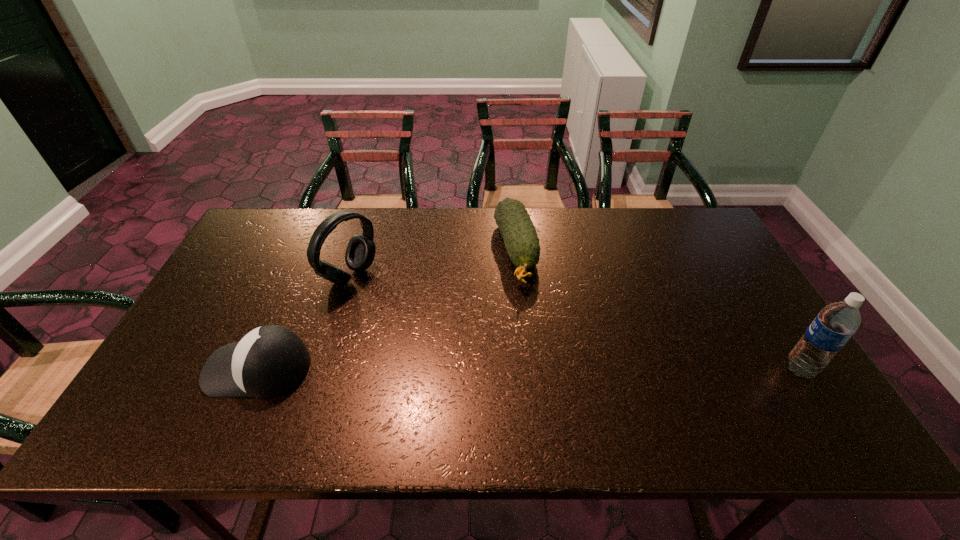
Locate an element on the screen. This screenshot has height=540, width=960. vacant space located on the earcups of the headset is located at coordinates (435, 326).

I want to click on free space located on the earcups of the headset, so click(x=424, y=319).

This screenshot has height=540, width=960. I want to click on object that is at the far edge, so click(x=520, y=237).

Identify the location of cap present at the near edge. (270, 360).

You are a GUI agent. You are given a task and a screenshot of the screen. Output one action in this format:
    pyautogui.click(x=<x>, y=<y>)
    Task: Click on the water bottle that is at the near edge
    
    Given the screenshot: What is the action you would take?
    pyautogui.click(x=836, y=323)

Locate an element on the screen. This screenshot has width=960, height=540. object located in the left edge section of the desktop is located at coordinates (270, 360).

In order to click on object situated at the right edge in this screenshot , I will do `click(836, 323)`.

Where is `object that is positioned at the near left corner`? object that is positioned at the near left corner is located at coordinates (270, 360).

You are a GUI agent. You are given a task and a screenshot of the screen. Output one action in this format:
    pyautogui.click(x=<x>, y=<y>)
    Task: Click on the object situated at the near right corner
    
    Given the screenshot: What is the action you would take?
    pyautogui.click(x=836, y=323)

You are a GUI agent. You are given a task and a screenshot of the screen. Output one action in this format:
    pyautogui.click(x=<x>, y=<y>)
    Task: Click on the vacant space at the far edge of the desktop
    Image resolution: width=960 pixels, height=540 pixels.
    Given the screenshot: What is the action you would take?
    pyautogui.click(x=373, y=226)